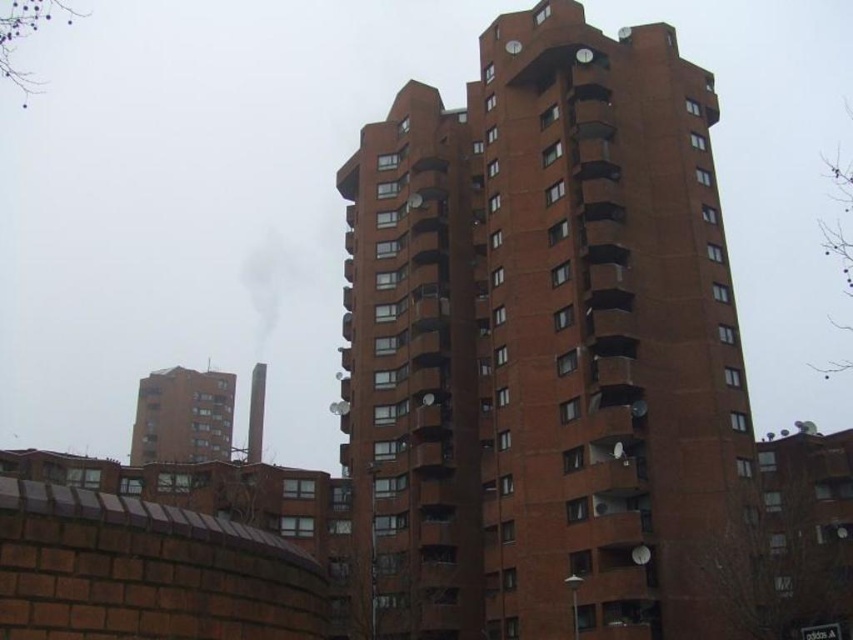
Question: In this image, where is brick tower block at center located relative to smooth gray chimney at center?

Choices:
 (A) right
 (B) left

Answer: (A)

Question: Does brick tower block at center have a larger size compared to smooth gray chimney at center?

Choices:
 (A) no
 (B) yes

Answer: (B)

Question: Which of the following is the closest to the observer?

Choices:
 (A) smooth gray chimney at center
 (B) brick tower block at center

Answer: (B)

Question: Which object appears farthest from the camera in this image?

Choices:
 (A) brick tower block at center
 (B) smooth gray chimney at center

Answer: (B)

Question: Is brick tower block at center below smooth gray chimney at center?

Choices:
 (A) yes
 (B) no

Answer: (B)